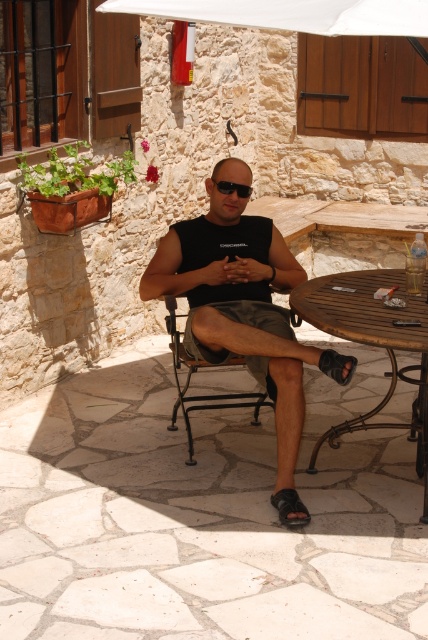
You are standing on the patio and want to place a small potted plant between the black matte tank top at center and the wooden table at center. Which object should the plant be closer to based on their positions?

The plant should be placed closer to the wooden table at center because the black matte tank top at center is closer to the viewer than the wooden table at center, so the distance between them requires the plant to be near the farther object to maintain balance.